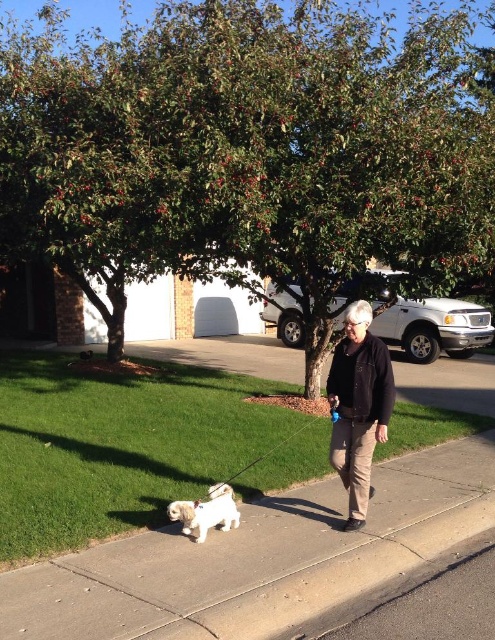
Which of these two, green leafy tree at upper center or black matte jacket at center, stands shorter?

Standing shorter between the two is black matte jacket at center.

Does point (384, 180) come farther from viewer compared to point (362, 372)?

Yes, it is.

This screenshot has height=640, width=495. I want to click on green leafy tree at upper center, so click(248, 150).

Does smooth concrete sidewalk at center have a smaller size compared to black matte jacket at center?

Actually, smooth concrete sidewalk at center might be larger than black matte jacket at center.

Does point (443, 444) lie in front of point (376, 388)?

No, it is not.

At what (x,y) coordinates should I click in order to perform the action: click on smooth concrete sidewalk at center. Please return your answer as a coordinate pair (x, y). The width and height of the screenshot is (495, 640). Looking at the image, I should click on (258, 557).

Which is above, green leafy tree at upper center or white fluffy dog at lower left?

green leafy tree at upper center

Is green leafy tree at upper center positioned before white fluffy dog at lower left?

That is False.

Locate an element on the screen. This screenshot has width=495, height=640. green leafy tree at upper center is located at coordinates (248, 150).